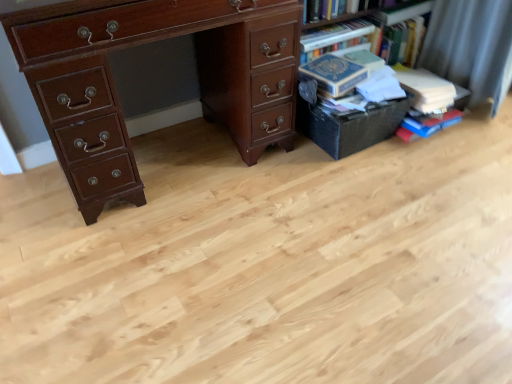
Question: In terms of size, does hardcover books at upper right appear bigger or smaller than hardcover book at right, the second book viewed from the left?

Choices:
 (A) small
 (B) big

Answer: (B)

Question: Looking at their shapes, would you say hardcover books at upper right is wider or thinner than hardcover book at right, acting as the 1th book starting from the right?

Choices:
 (A) thin
 (B) wide

Answer: (A)

Question: Which object is positioned farthest from the hardcover book at right, the 2th book positioned from the right?

Choices:
 (A) matte brown desk at left
 (B) hardcover book at right, the second book viewed from the left
 (C) black matte box at right
 (D) hardcover books at upper right

Answer: (A)

Question: Estimate the real-world distances between objects in this image. Which object is closer to the matte brown desk at left?

Choices:
 (A) hardcover books at upper right
 (B) hardcover book at right, the 2th book positioned from the right
 (C) hardcover book at right, the second book viewed from the left
 (D) black matte box at right

Answer: (D)